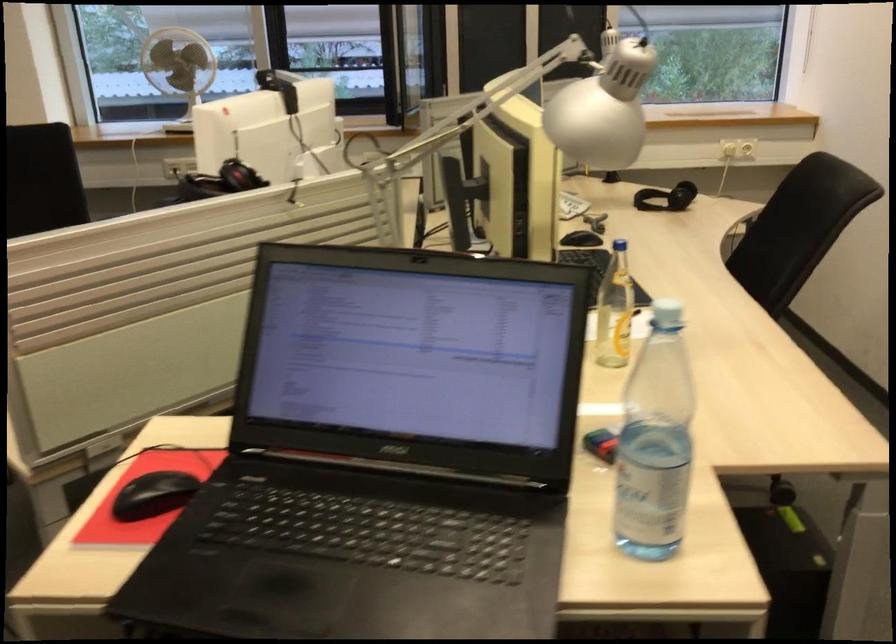
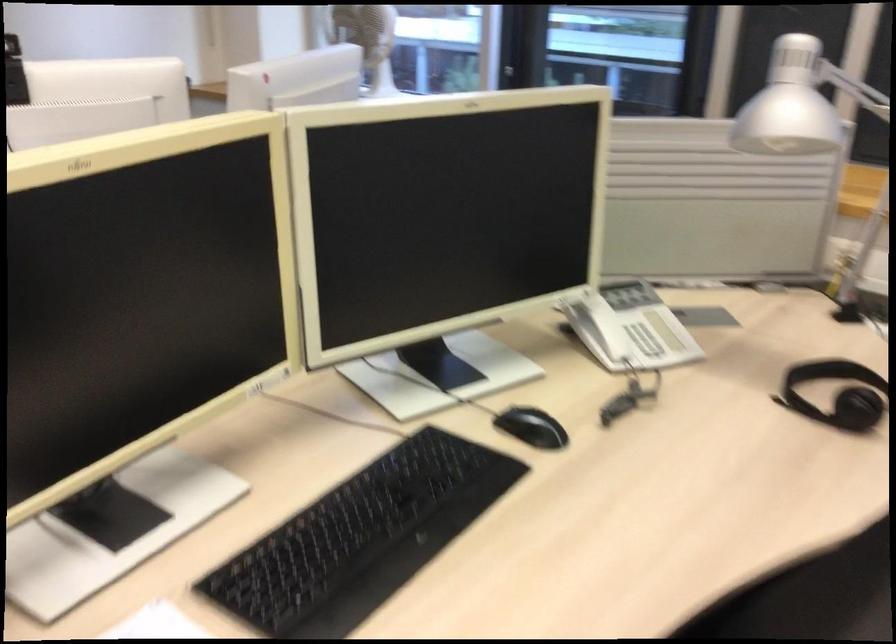
Locate, in the second image, the point that corresponds to point 655,199 in the first image.

(837, 393)